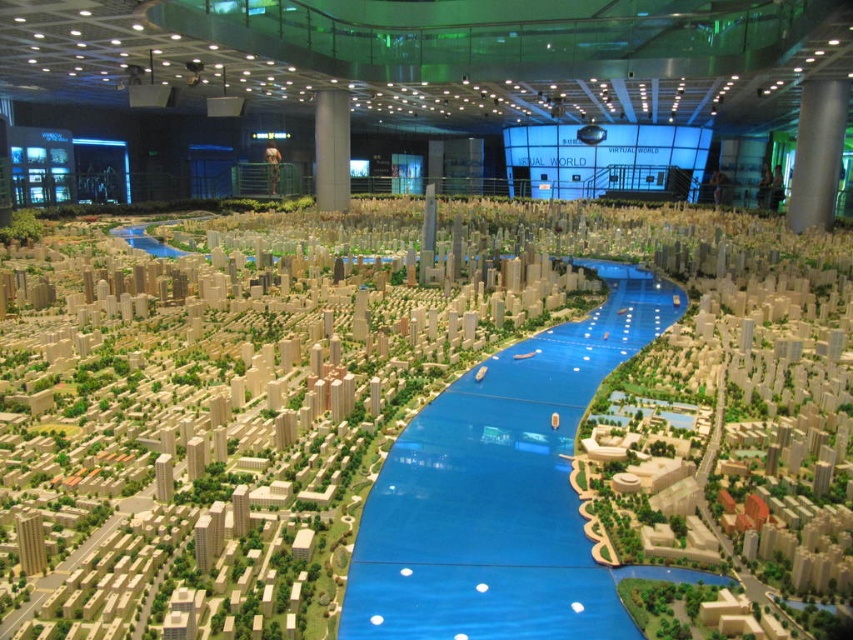
Is transparent blue waterway at center further to the viewer compared to metallic gray pillar at upper right?

No, transparent blue waterway at center is in front of metallic gray pillar at upper right.

What are the coordinates of `transparent blue waterway at center` in the screenshot? It's located at (502, 490).

Does point (570, 432) come farther from viewer compared to point (802, 90)?

No, (570, 432) is closer to viewer.

Identify the location of transparent blue waterway at center. (502, 490).

Measure the distance between point (543,512) and camera.

1.88 meters

Between transparent blue waterway at center and white glossy pillar at center, which one appears on the right side from the viewer's perspective?

transparent blue waterway at center

Find the location of a particular element. Image resolution: width=853 pixels, height=640 pixels. transparent blue waterway at center is located at coordinates (502, 490).

This screenshot has height=640, width=853. I want to click on transparent blue waterway at center, so click(x=502, y=490).

Consider the image. Measure the distance between point (837, 145) and camera.

They are 9.25 meters apart.

Which is more to the left, metallic gray pillar at upper right or white glossy pillar at center?

white glossy pillar at center is more to the left.

This screenshot has height=640, width=853. What are the coordinates of `metallic gray pillar at upper right` in the screenshot? It's located at (817, 154).